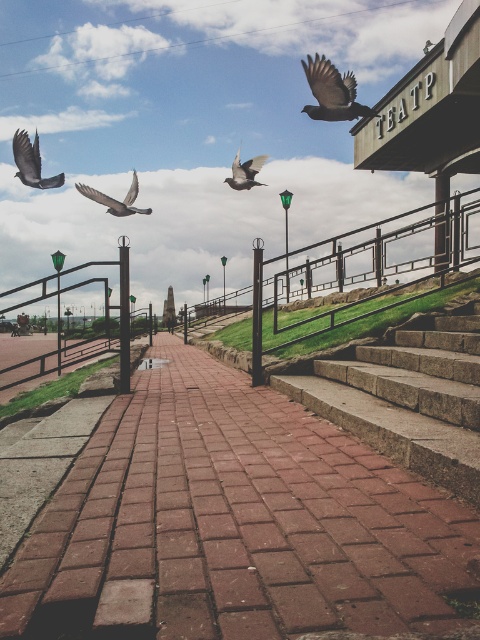
Can you confirm if brick pavement at center is taller than matte gray bird at center?

No, brick pavement at center is not taller than matte gray bird at center.

Which is more to the right, brick pavement at center or matte gray bird at center?

brick pavement at center

I want to click on brick pavement at center, so click(x=233, y=524).

Does stone steps at center appear over gray matte pigeon at center?

No.

The image size is (480, 640). What do you see at coordinates (408, 397) in the screenshot?
I see `stone steps at center` at bounding box center [408, 397].

The image size is (480, 640). I want to click on stone steps at center, so click(408, 397).

Between matte black bird at upper right and matte gray bird at center, which one is positioned higher?

Positioned higher is matte black bird at upper right.

The height and width of the screenshot is (640, 480). What are the coordinates of `matte black bird at upper right` in the screenshot? It's located at (332, 92).